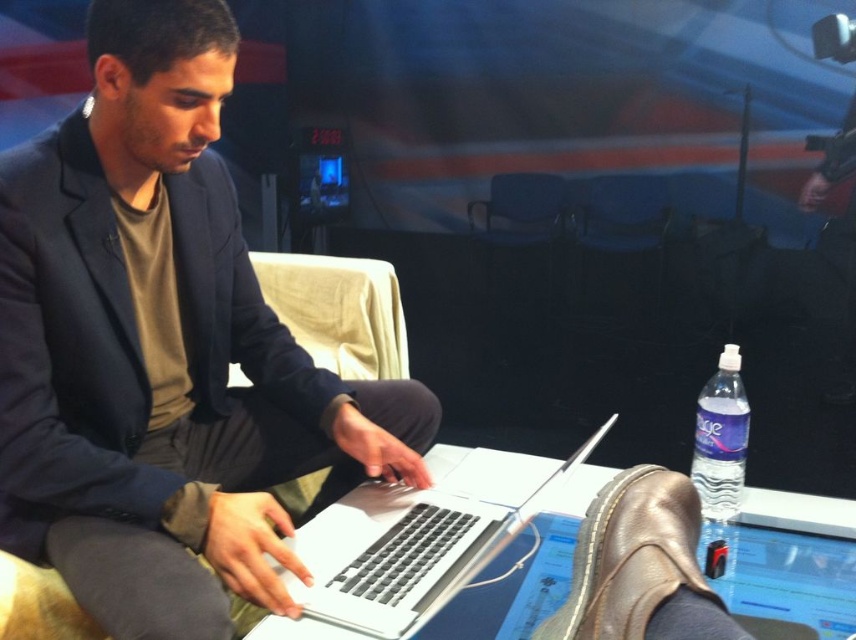
Is matte black laptop at center smaller than clear plastic water bottle at lower right?

No, matte black laptop at center is not smaller than clear plastic water bottle at lower right.

Is matte black laptop at center further to the viewer compared to clear plastic water bottle at lower right?

Answer: No, matte black laptop at center is closer to the viewer.

You are a GUI agent. You are given a task and a screenshot of the screen. Output one action in this format:
    pyautogui.click(x=<x>, y=<y>)
    Task: Click on the matte black laptop at center
    Image resolution: width=856 pixels, height=640 pixels.
    Given the screenshot: What is the action you would take?
    pyautogui.click(x=162, y=352)

Identify the location of matte black laptop at center. click(162, 352).

Is matte black laptop at center taller than blue fabric armchair at center?

Yes.

Measure the distance between matte black laptop at center and camera.

matte black laptop at center is 31.93 inches from camera.

Which is in front, point (144, 465) or point (663, 221)?

Positioned in front is point (144, 465).

At what (x,y) coordinates should I click in order to perform the action: click on matte black laptop at center. Please return your answer as a coordinate pair (x, y). This screenshot has width=856, height=640. Looking at the image, I should click on (162, 352).

Which is in front, point (361, 584) or point (609, 236)?

Point (361, 584)

Between silver metallic laptop at center and blue fabric armchair at center, which one has more height?

Standing taller between the two is blue fabric armchair at center.

Between point (446, 582) and point (639, 188), which one is positioned behind?

The point (639, 188) is more distant.

You are a GUI agent. You are given a task and a screenshot of the screen. Output one action in this format:
    pyautogui.click(x=<x>, y=<y>)
    Task: Click on the silver metallic laptop at center
    Image resolution: width=856 pixels, height=640 pixels.
    Given the screenshot: What is the action you would take?
    pyautogui.click(x=401, y=556)